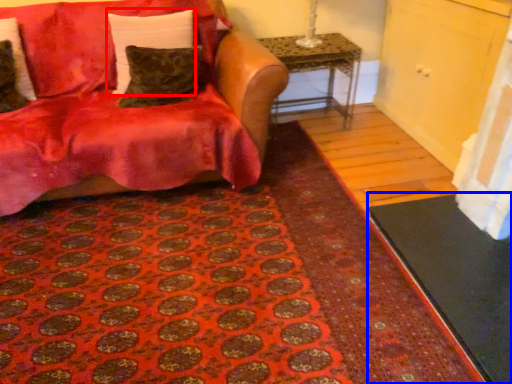
Question: Among these objects, which one is nearest to the camera, pillow (highlighted by a red box) or doormat (highlighted by a blue box)?

Choices:
 (A) pillow
 (B) doormat

Answer: (B)